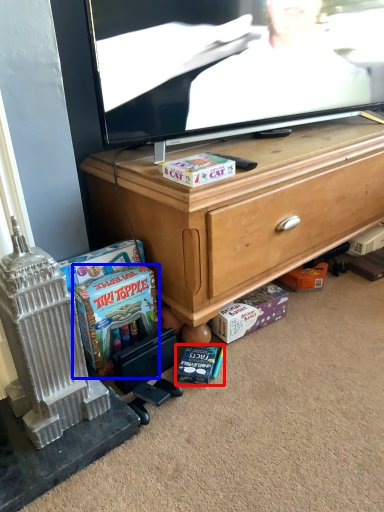
Question: Which of the following is the farthest to the observer, book (highlighted by a red box) or cash (highlighted by a blue box)?

Choices:
 (A) book
 (B) cash

Answer: (A)